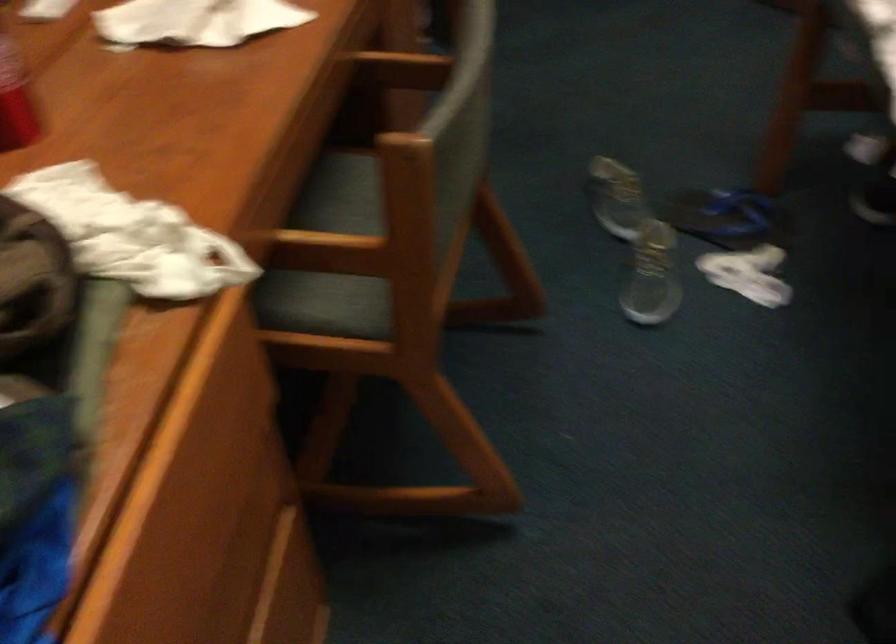
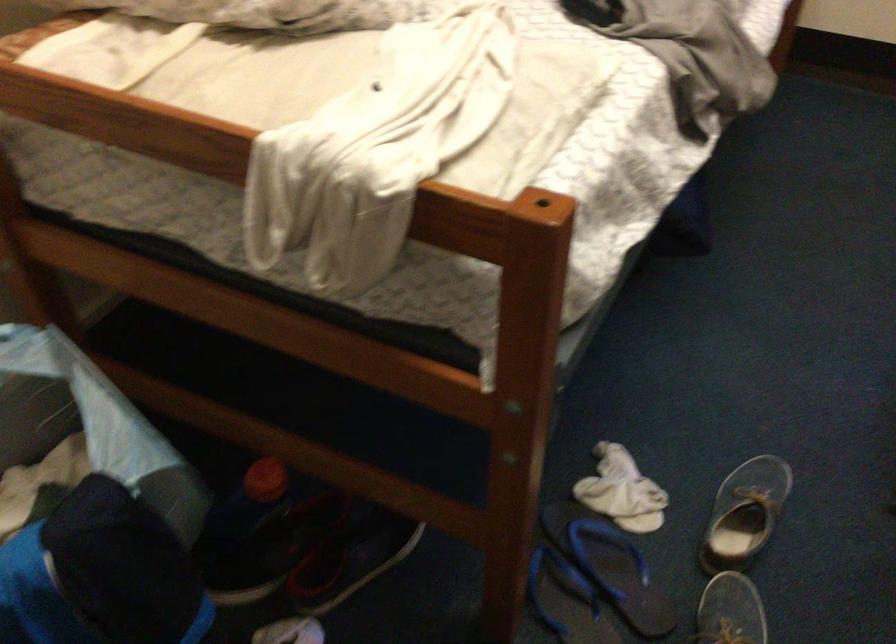
The point at [744,267] is marked in the first image. Where is the corresponding point in the second image?

(622, 491)